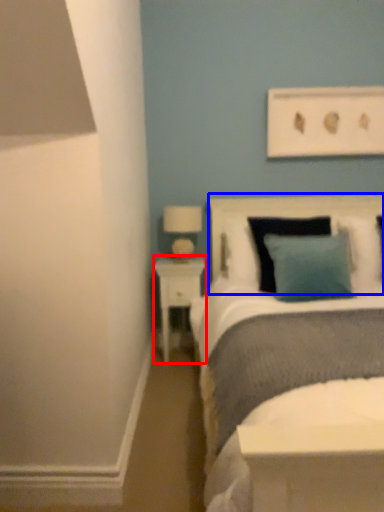
Question: Among these objects, which one is nearest to the camera, nightstand (highlighted by a red box) or headboard (highlighted by a blue box)?

Choices:
 (A) nightstand
 (B) headboard

Answer: (B)